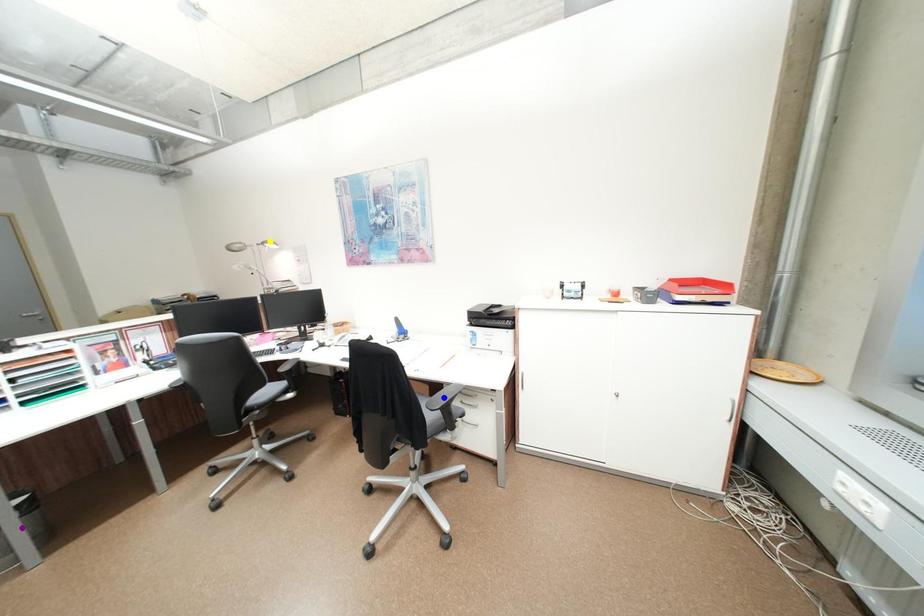
Order these from nearest to farthest:
1. blue point
2. yellow point
3. purple point

purple point
blue point
yellow point